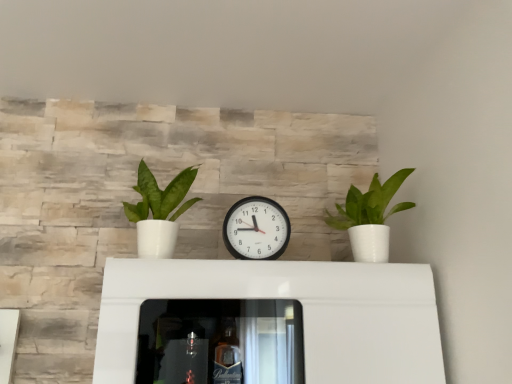
Question: From a real-world perspective, is black plastic wall clock at center on top of white glossy pot at right, acting as the second houseplant starting from the left?

Choices:
 (A) no
 (B) yes

Answer: (A)

Question: Is black plastic wall clock at center wider than white glossy pot at right, the first houseplant when ordered from right to left?

Choices:
 (A) no
 (B) yes

Answer: (A)

Question: Considering the relative sizes of black plastic wall clock at center and white glossy pot at right, the first houseplant when ordered from right to left, in the image provided, is black plastic wall clock at center bigger than white glossy pot at right, the first houseplant when ordered from right to left,?

Choices:
 (A) no
 (B) yes

Answer: (A)

Question: From the image's perspective, is black plastic wall clock at center below white glossy pot at right, the first houseplant when ordered from right to left?

Choices:
 (A) yes
 (B) no

Answer: (A)

Question: Is black plastic wall clock at center behind white glossy pot at right, acting as the second houseplant starting from the left?

Choices:
 (A) yes
 (B) no

Answer: (A)

Question: Looking at their shapes, would you say black plastic wall clock at center is wider or thinner than green matte plant at left, arranged as the 1th houseplant when viewed from the left?

Choices:
 (A) wide
 (B) thin

Answer: (B)

Question: From a real-world perspective, relative to green matte plant at left, the 2th houseplant from the right, is black plastic wall clock at center vertically above or below?

Choices:
 (A) above
 (B) below

Answer: (B)

Question: Is black plastic wall clock at center bigger or smaller than green matte plant at left, the 2th houseplant from the right?

Choices:
 (A) small
 (B) big

Answer: (A)

Question: In the image, is black plastic wall clock at center on the left side or the right side of green matte plant at left, the 2th houseplant from the right?

Choices:
 (A) left
 (B) right

Answer: (B)

Question: Choose the correct answer: Is black plastic wall clock at center inside white glossy pot at right, acting as the second houseplant starting from the left, or outside it?

Choices:
 (A) outside
 (B) inside

Answer: (A)

Question: Looking at their shapes, would you say black plastic wall clock at center is wider or thinner than white glossy pot at right, the first houseplant when ordered from right to left?

Choices:
 (A) wide
 (B) thin

Answer: (B)

Question: From a real-world perspective, is black plastic wall clock at center above or below white glossy pot at right, acting as the second houseplant starting from the left?

Choices:
 (A) below
 (B) above

Answer: (A)

Question: Is point (247, 200) positioned closer to the camera than point (387, 233)?

Choices:
 (A) farther
 (B) closer

Answer: (A)

Question: From the image's perspective, is green matte plant at left, the 2th houseplant from the right, above or below white glossy pot at right, acting as the second houseplant starting from the left?

Choices:
 (A) below
 (B) above

Answer: (B)

Question: Is green matte plant at left, arranged as the 1th houseplant when viewed from the left, wider or thinner than white glossy pot at right, acting as the second houseplant starting from the left?

Choices:
 (A) thin
 (B) wide

Answer: (B)